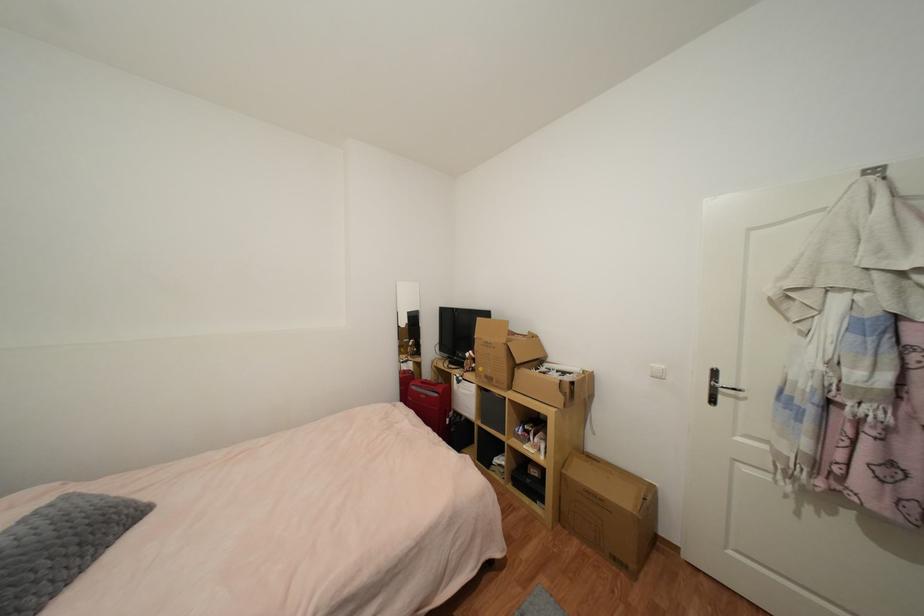
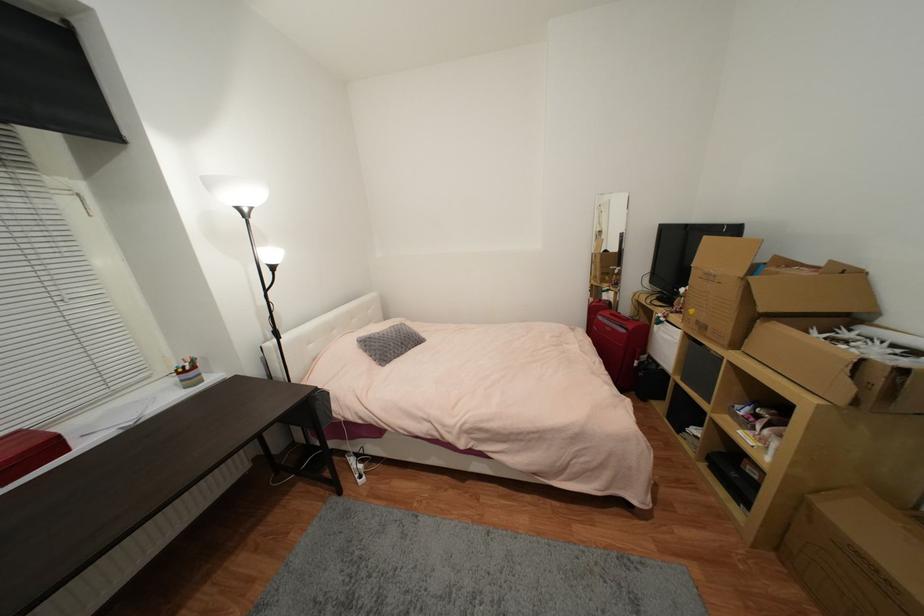
In the second image, find the point that corresponds to point (523, 363) in the first image.

(767, 310)